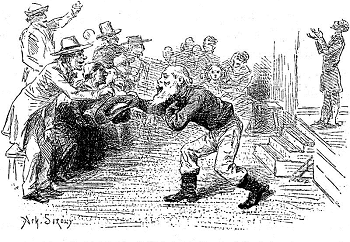
You are a GUI agent. You are given a task and a screenshot of the screen. Output one action in this format:
    pyautogui.click(x=<x>, y=<y>)
    Task: Click on the floor
    The height and width of the screenshot is (242, 350).
    Given the screenshot: What is the action you would take?
    pyautogui.click(x=110, y=184)